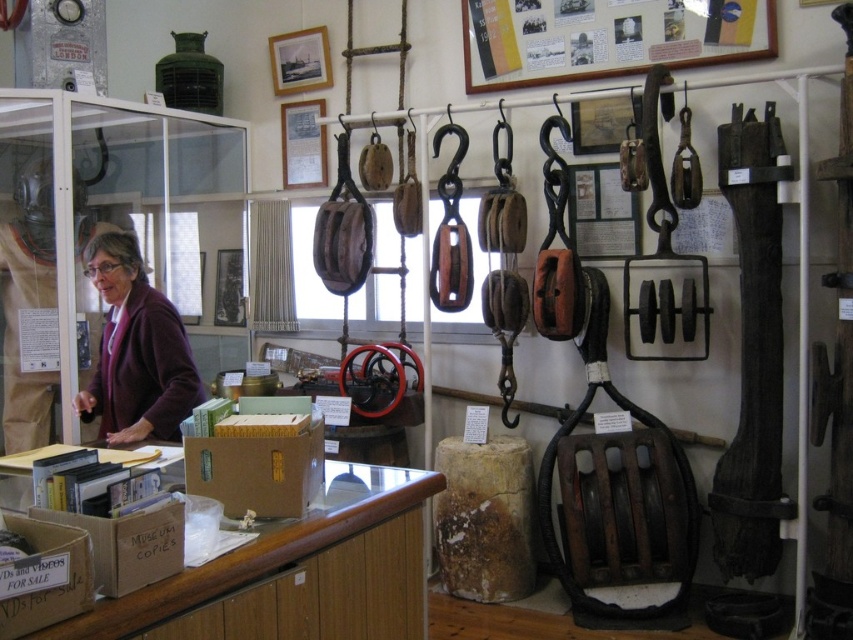
You are a visitor at the museum and want to measure the distance between the wooden frame at upper center and the nearest window. Can you estimate how far apart they are?

The wooden frame at upper center is 10.37 feet away from the nearest window.

You are a visitor at the museum and want to know the distance between the wooden frame at upper center and the matte purple sweater at left. Can you estimate how far apart they are?

The wooden frame at upper center and the matte purple sweater at left are 2.05 meters apart from each other.

Consider the image. You are a visitor at the museum and see the wooden frame at upper center and the matte purple sweater at left. Which object is located higher in the image?

The wooden frame at upper center is positioned over the matte purple sweater at left, so it is higher in the image.